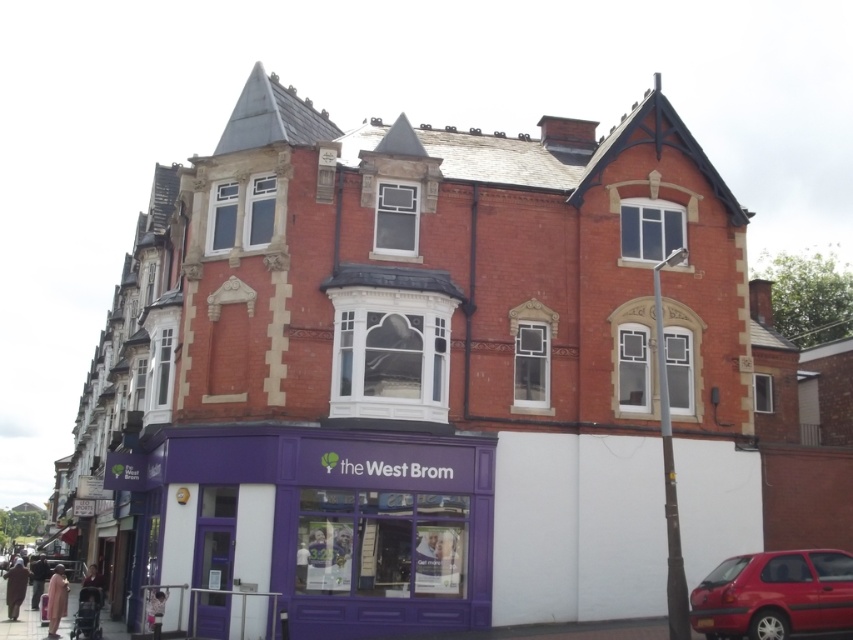
You are a GUI agent. You are given a task and a screenshot of the screen. Output one action in this format:
    pyautogui.click(x=<x>, y=<y>)
    Task: Click on the purple matte storefront at lower left
    The width and height of the screenshot is (853, 640).
    Given the screenshot: What is the action you would take?
    pyautogui.click(x=325, y=522)

Does purple matte storefront at lower left have a larger size compared to shiny red car at lower right?

Yes.

What do you see at coordinates (325, 522) in the screenshot? I see `purple matte storefront at lower left` at bounding box center [325, 522].

Identify the location of purple matte storefront at lower left. The image size is (853, 640). (325, 522).